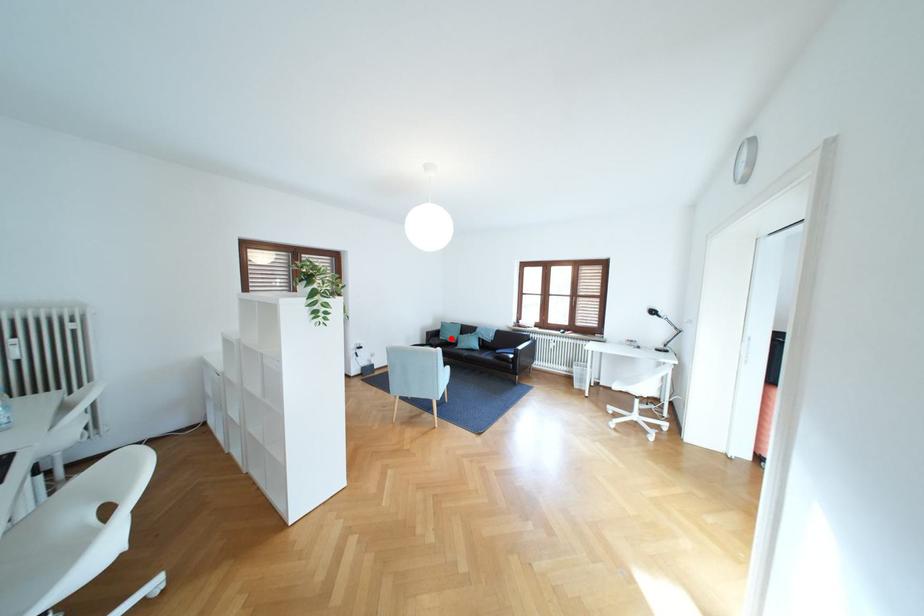
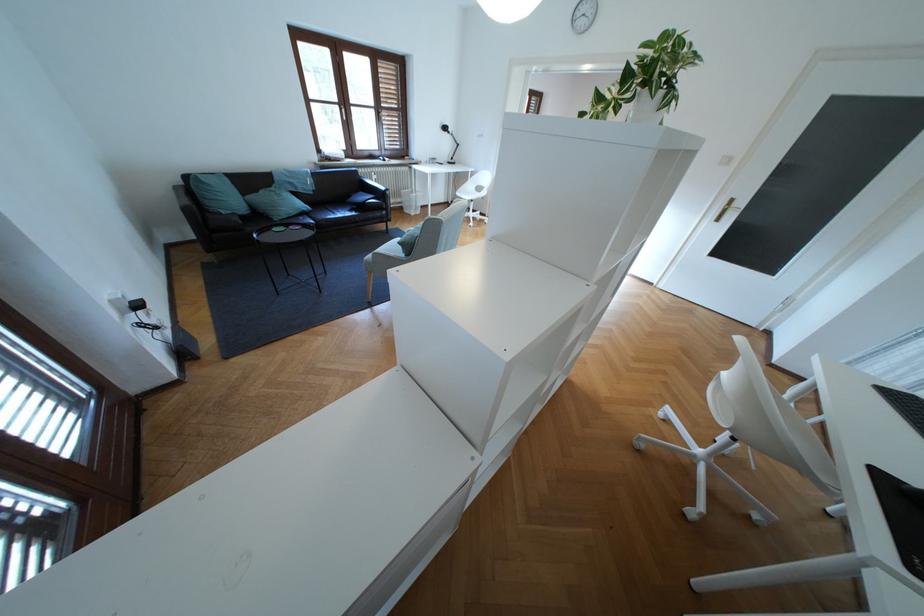
Locate, in the second image, the point that corresponds to the highlighted location in the first image.

(234, 213)